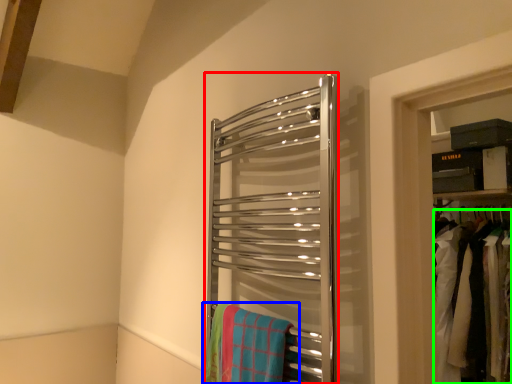
Question: Which is nearer to the towel rack (highlighted by a red box)? beach towel (highlighted by a blue box) or laundry (highlighted by a green box).

Choices:
 (A) beach towel
 (B) laundry

Answer: (A)